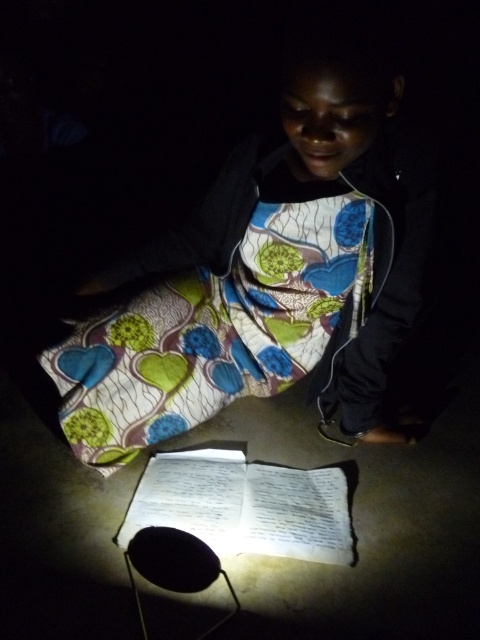
Question: Observing the image, what is the correct spatial positioning of printed fabric dress at center in reference to white paper book at center?

Choices:
 (A) below
 (B) above

Answer: (B)

Question: Does printed fabric dress at center lie behind white paper book at center?

Choices:
 (A) yes
 (B) no

Answer: (B)

Question: Is printed fabric dress at center closer to camera compared to white paper book at center?

Choices:
 (A) yes
 (B) no

Answer: (A)